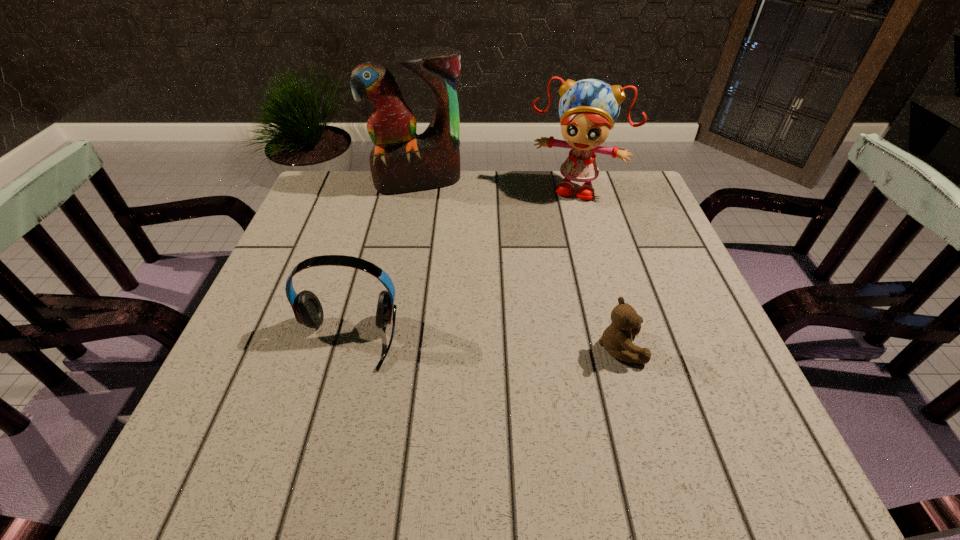
Locate an element on the screen. The height and width of the screenshot is (540, 960). vacant space on the desktop that is between the headset and the shortest object and is positioned at the face of the tallest object is located at coordinates (449, 343).

Locate an element on the screen. Image resolution: width=960 pixels, height=540 pixels. free space on the desktop that is between the third tallest object and the shortest object and is positioned on the face of the doll is located at coordinates (522, 345).